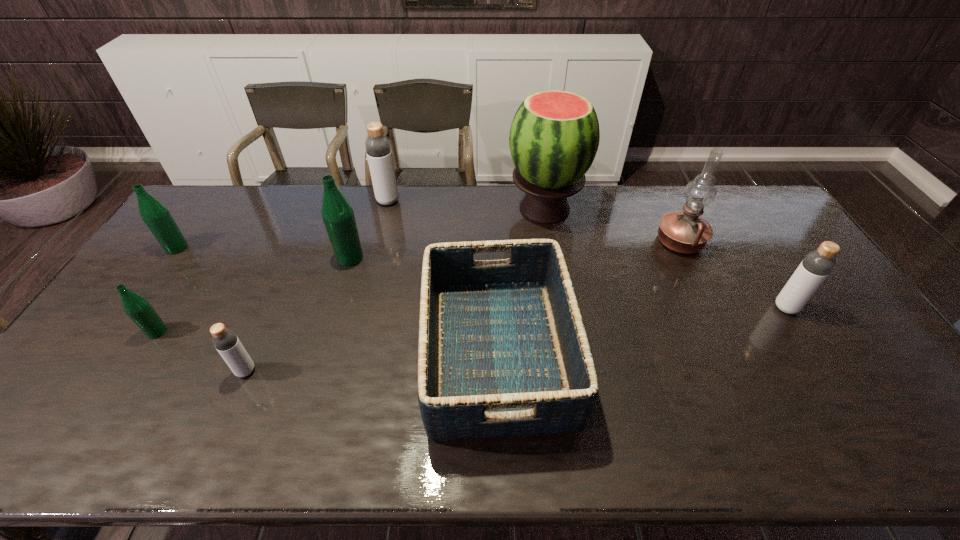
Locate an element on the screen. This screenshot has width=960, height=540. green watermelon is located at coordinates (554, 137).

The width and height of the screenshot is (960, 540). Find the location of `the eighth object from left to right`. the eighth object from left to right is located at coordinates (685, 232).

In order to click on the farthest gray bottle in this screenshot , I will do `click(378, 148)`.

Where is `the second gray bottle from right to left`? This screenshot has height=540, width=960. the second gray bottle from right to left is located at coordinates (378, 148).

I want to click on the rightmost green bottle, so click(337, 213).

Locate an element on the screen. the leftmost green bottle is located at coordinates (156, 216).

Locate an element on the screen. The height and width of the screenshot is (540, 960). the leftmost bottle is located at coordinates (156, 216).

This screenshot has height=540, width=960. What are the coordinates of `the rightmost bottle` in the screenshot? It's located at (816, 266).

Locate an element on the screen. the fourth farthest bottle is located at coordinates (816, 266).

What are the coordinates of `blue basket` in the screenshot? It's located at (503, 352).